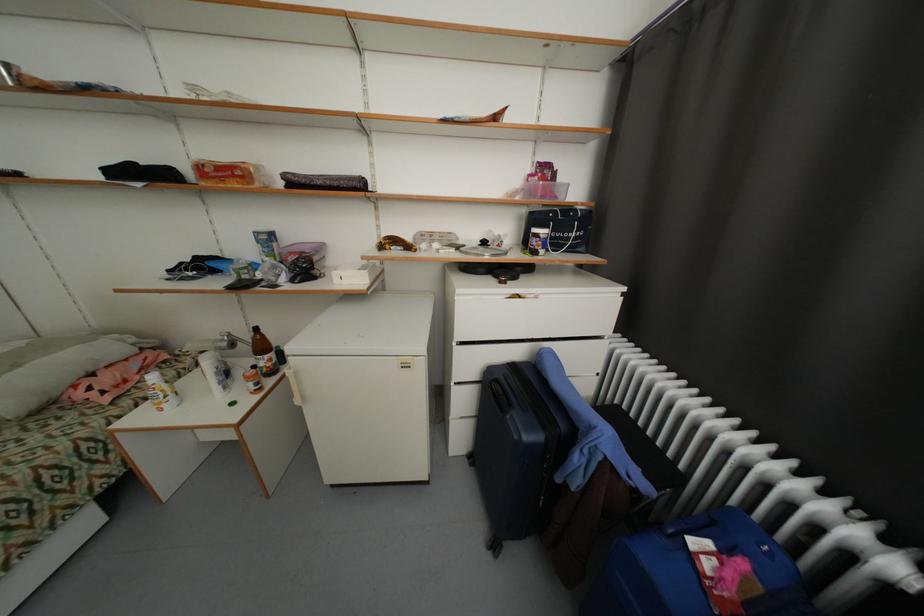
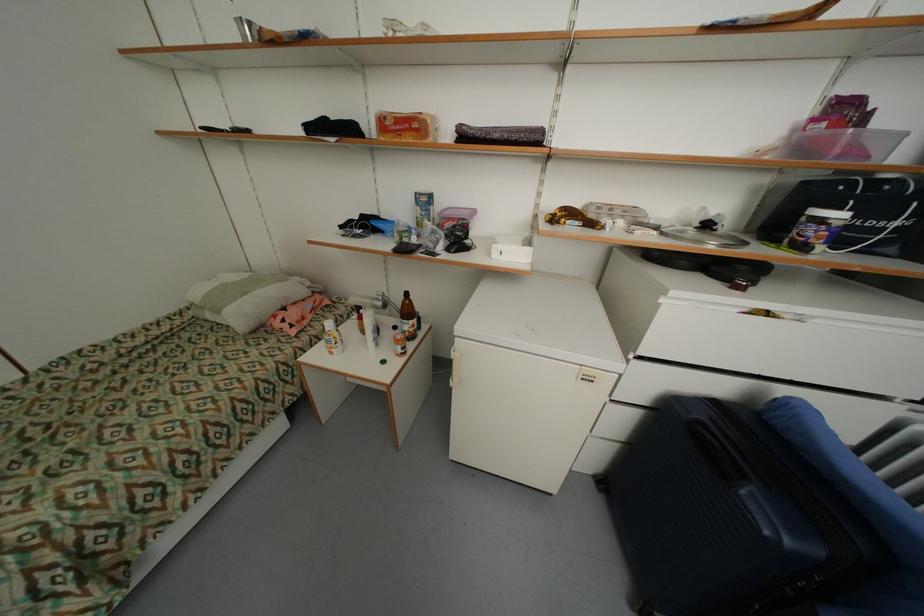
Question: The camera is either moving clockwise (left) or counter-clockwise (right) around the object. The first image is from the beginning of the video and the second image is from the end. Is the camera moving left or right when shooting the video?

Choices:
 (A) Left
 (B) Right

Answer: (B)